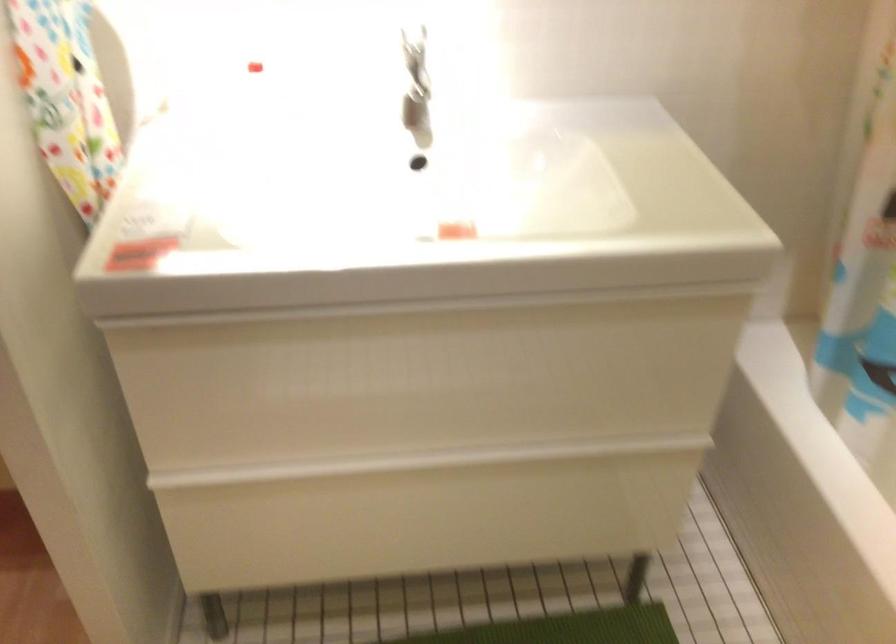
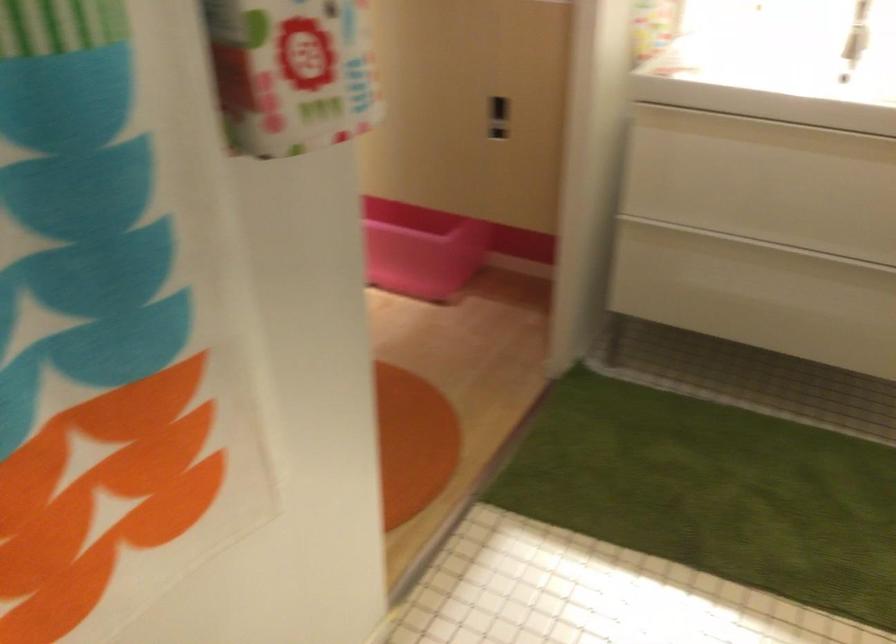
Question: The first image is from the beginning of the video and the second image is from the end. How did the camera likely rotate when shooting the video?

Choices:
 (A) Left
 (B) Right
 (C) Up
 (D) Down

Answer: (A)